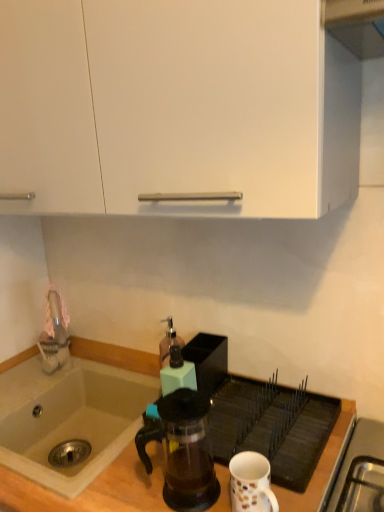
Question: Considering their positions, is white ceramic mug at lower right located in front of or behind matte plastic soap dispenser at center, the 2th kitchen appliance in the back-to-front sequence?

Choices:
 (A) front
 (B) behind

Answer: (A)

Question: In terms of height, does white ceramic mug at lower right look taller or shorter compared to matte plastic soap dispenser at center, the 2th kitchen appliance in the back-to-front sequence?

Choices:
 (A) tall
 (B) short

Answer: (B)

Question: Which object is the closest to the matte plastic soap dispenser at center, which is counted as the 1th kitchen appliance, starting from the front?

Choices:
 (A) white ceramic mug at lower right
 (B) translucent glass soap dispenser at center, arranged as the 2th kitchen appliance when viewed from the front
 (C) white matte cabinet at upper center
 (D) transparent glass coffee maker at center
 (E) beige ceramic sink at lower left

Answer: (B)

Question: Considering the real-world distances, which object is closest to the translucent glass soap dispenser at center, arranged as the 2th kitchen appliance when viewed from the front?

Choices:
 (A) white matte cabinet at upper center
 (B) matte plastic soap dispenser at center, which is counted as the 1th kitchen appliance, starting from the front
 (C) white ceramic mug at lower right
 (D) beige ceramic sink at lower left
 (E) wooden counter top at lower center

Answer: (B)